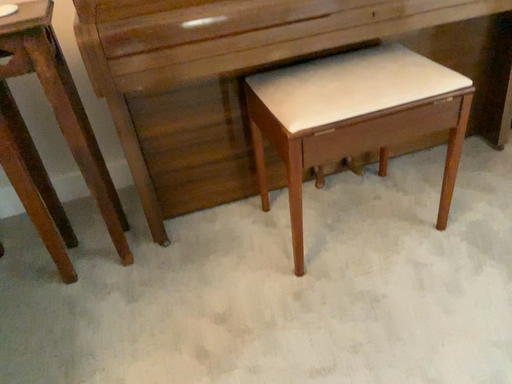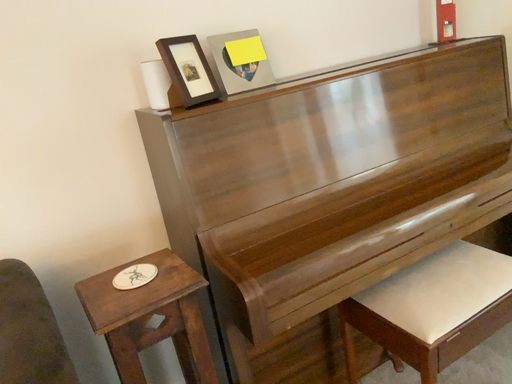
Question: How did the camera likely rotate when shooting the video?

Choices:
 (A) rotated left
 (B) rotated right

Answer: (B)